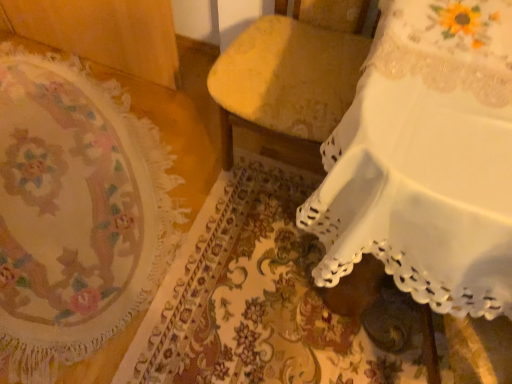
Question: Visually, is white lace tablecloth at upper right, the 1th furniture from the right, positioned to the left or to the right of floral tapestry at left?

Choices:
 (A) left
 (B) right

Answer: (B)

Question: From a real-world perspective, is white lace tablecloth at upper right, which appears as the second furniture when viewed from the left, above or below floral tapestry at left?

Choices:
 (A) above
 (B) below

Answer: (A)

Question: Which of these objects is positioned closest to the velvet yellow chair at center, which ranks as the first furniture in left-to-right order?

Choices:
 (A) white lace tablecloth at upper right, the 1th furniture from the right
 (B) floral tapestry at left

Answer: (A)

Question: Which object is positioned closest to the white lace tablecloth at upper right, the 1th furniture from the right?

Choices:
 (A) velvet yellow chair at center, which ranks as the first furniture in left-to-right order
 (B) floral tapestry at left

Answer: (A)